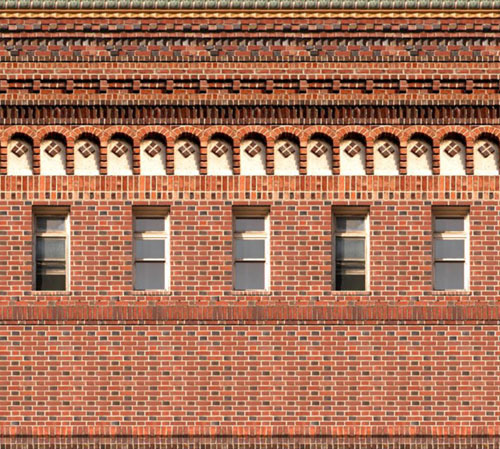
Identify the location of open windows. (52, 283), (352, 282).